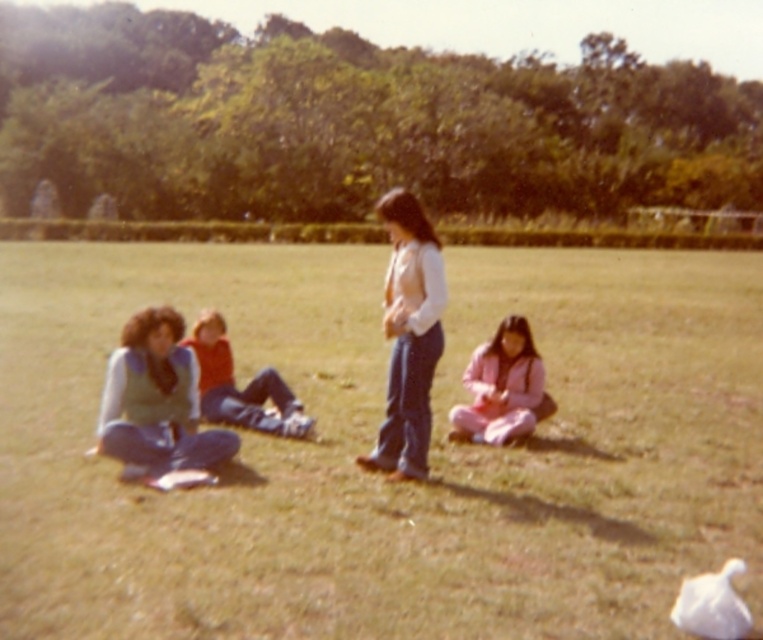
Question: Observing the image, what is the correct spatial positioning of green grass at center in reference to white matte vest at center?

Choices:
 (A) above
 (B) below

Answer: (B)

Question: Is white matte vest at center further to camera compared to velvet red vest at lower left?

Choices:
 (A) no
 (B) yes

Answer: (A)

Question: Based on their relative distances, which object is farther from the white matte vest at center?

Choices:
 (A) pink fleece jacket at lower right
 (B) velvet red vest at lower left
 (C) green grass at center

Answer: (C)

Question: Which of the following is the closest to the observer?

Choices:
 (A) (396, 461)
 (B) (242, 435)
 (C) (509, 387)
 (D) (217, 360)

Answer: (A)

Question: Is white matte vest at center bigger than velvet red vest at lower left?

Choices:
 (A) no
 (B) yes

Answer: (B)

Question: Which point appears farthest from the camera in this image?

Choices:
 (A) (208, 333)
 (B) (417, 456)
 (C) (102, 420)
 (D) (559, 275)

Answer: (D)